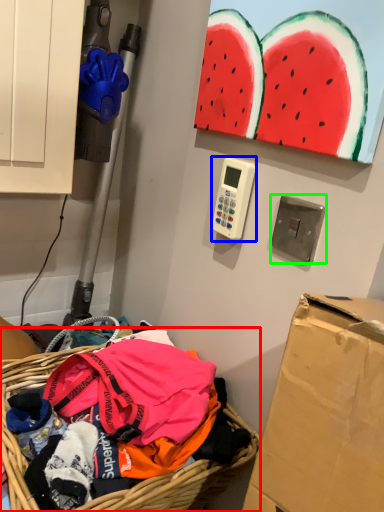
Question: Considering the real-world distances, which object is closest to basket (highlighted by a red box)? scale (highlighted by a blue box) or light switch (highlighted by a green box).

Choices:
 (A) scale
 (B) light switch

Answer: (A)